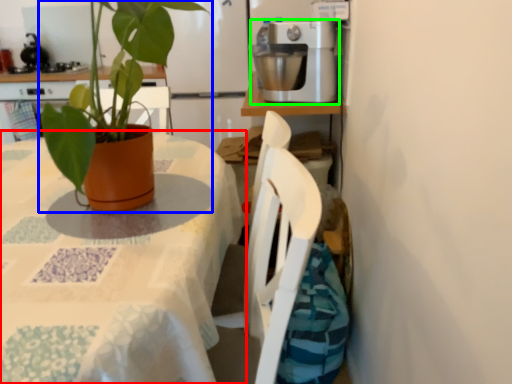
Question: Which is farther away from table (highlighted by a red box)? houseplant (highlighted by a blue box) or kitchen appliance (highlighted by a green box)?

Choices:
 (A) houseplant
 (B) kitchen appliance

Answer: (B)